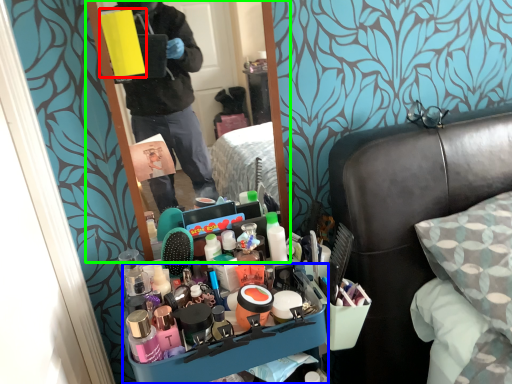
Question: Which object is positioned farthest from box (highlighted by a red box)? Select from desk (highlighted by a blue box) and mirror (highlighted by a green box).

Choices:
 (A) desk
 (B) mirror

Answer: (B)